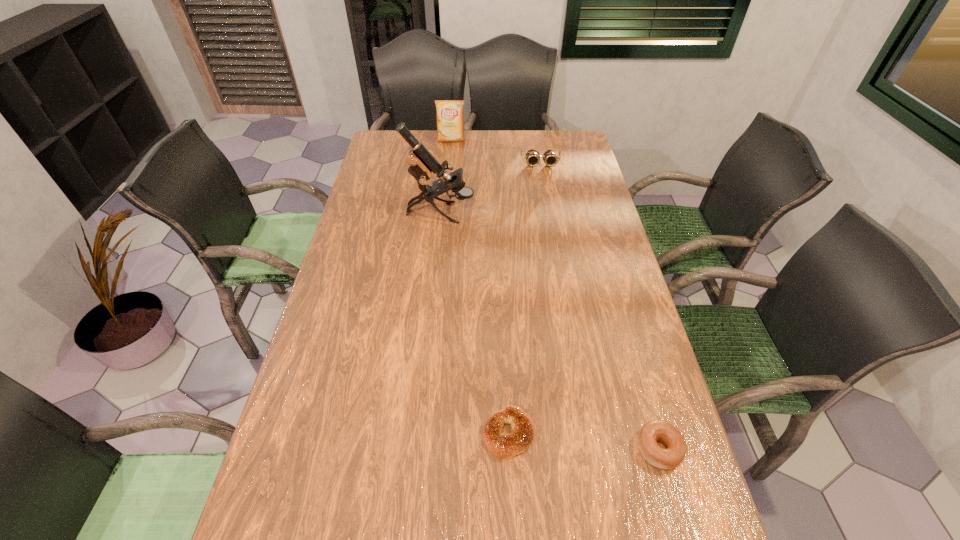
In order to click on unoccupied area between the tallest object and the third object from right to left in this screenshot , I will do pos(474,323).

Locate an element on the screen. This screenshot has height=540, width=960. free space between the taller bagel and the second tallest object is located at coordinates (555, 294).

Locate an element on the screen. The image size is (960, 540). vacant area between the farthest object and the right bagel is located at coordinates (555, 294).

This screenshot has height=540, width=960. What are the coordinates of `object that is the second closest to the shortest object` in the screenshot? It's located at (x=422, y=163).

Where is `the closest object relative to the taller bagel`? the closest object relative to the taller bagel is located at coordinates (507, 446).

This screenshot has height=540, width=960. What are the coordinates of `vacant point that satisfies the following two spatial constraints: 1. through the eyepiece of the tallest object; 2. on the right side of the shortest object` in the screenshot? It's located at (419, 434).

Find the location of `free region that satisfies the following two spatial constraints: 1. through the lenses of the fourth object from left to right; 2. on the right side of the rightmost object`. free region that satisfies the following two spatial constraints: 1. through the lenses of the fourth object from left to right; 2. on the right side of the rightmost object is located at coordinates (590, 449).

The image size is (960, 540). Find the location of `blank area in the image that satisfies the following two spatial constraints: 1. on the front-facing side of the shortest object; 2. on the left side of the farthest object`. blank area in the image that satisfies the following two spatial constraints: 1. on the front-facing side of the shortest object; 2. on the left side of the farthest object is located at coordinates (425, 434).

In order to click on free space that satisfies the following two spatial constraints: 1. through the eyepiece of the taller bagel; 2. on the right side of the microscope in this screenshot , I will do `click(417, 449)`.

Identify the location of free spot that satisfies the following two spatial constraints: 1. on the back side of the left bagel; 2. through the eyepiece of the third nearest object. The height and width of the screenshot is (540, 960). (498, 213).